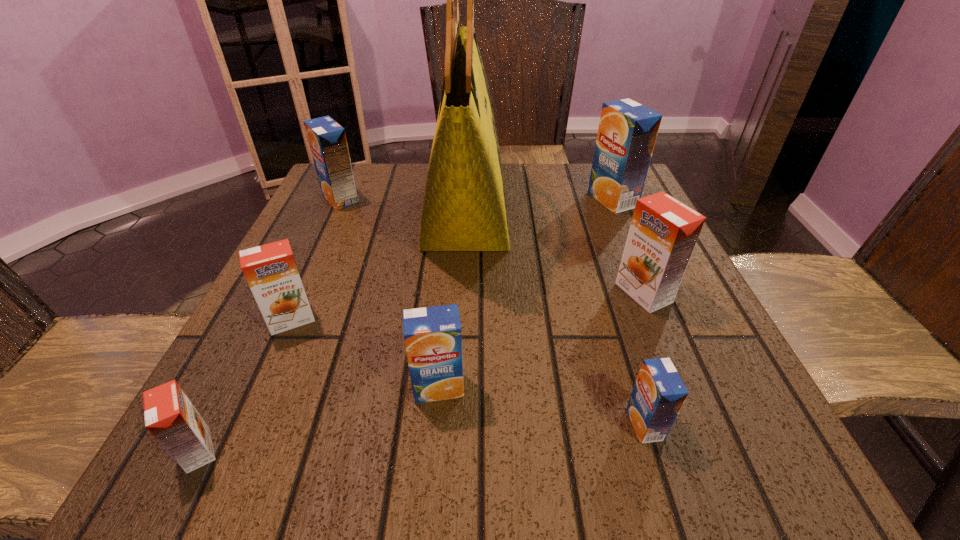
Select which blue orange_juice is the fourth closest to the yellow tote bag. Please provide its 2D coordinates. Your answer should be formatted as a tuple, i.e. [(x, y)], where the tuple contains the x and y coordinates of a point satisfying the conditions above.

[(659, 393)]

Where is `the second closest orange orange juice to the nearest orange orange juice`? Image resolution: width=960 pixels, height=540 pixels. the second closest orange orange juice to the nearest orange orange juice is located at coordinates [663, 233].

Locate an element on the screen. This screenshot has height=540, width=960. the third closest orange orange juice relative to the fifth orange juice from left to right is located at coordinates (170, 417).

Find the location of a particular element. The width and height of the screenshot is (960, 540). free space that satisfies the following two spatial constraints: 1. on the front side of the fifth farthest orange juice; 2. on the left side of the second biggest orange orange juice is located at coordinates (261, 387).

Locate an element on the screen. The height and width of the screenshot is (540, 960). free space that satisfies the following two spatial constraints: 1. on the front side of the second smallest orange orange juice; 2. on the right side of the smallest blue orange_juice is located at coordinates (245, 424).

I want to click on vacant space that satisfies the following two spatial constraints: 1. on the front-facing side of the nearest blue orange_juice; 2. on the right side of the yellow tote bag, so click(x=457, y=424).